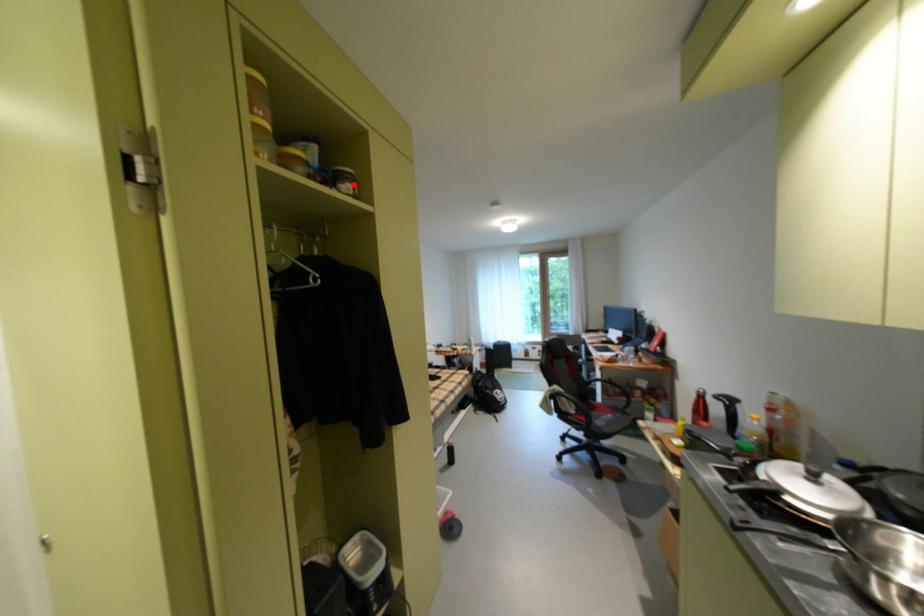
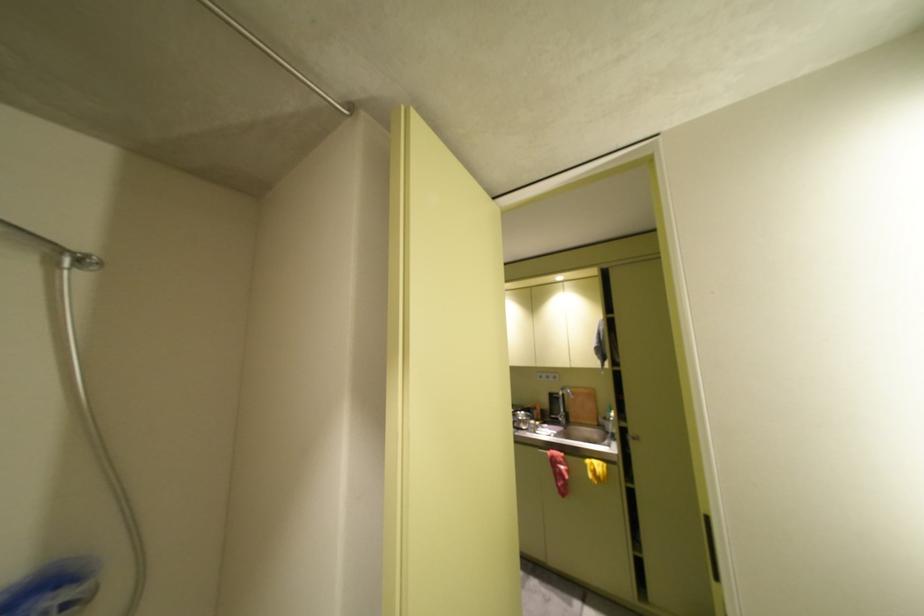
Question: I am providing you with two images of the same scene from different viewpoints. A red point is marked on the first image. Is the red point's position out of view in image 2?

Choices:
 (A) Yes
 (B) No

Answer: (A)